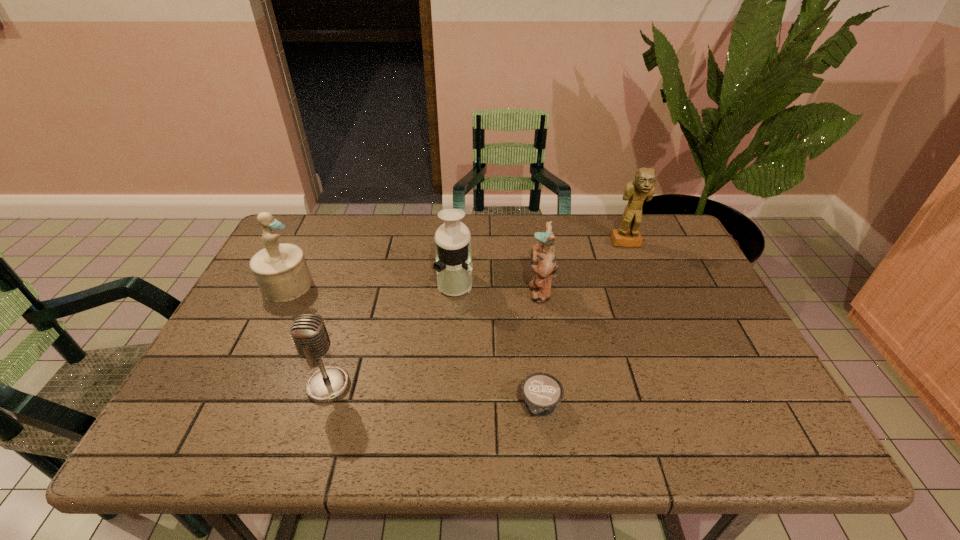
Where is `free space between the yogurt and the leftmost figurine`? free space between the yogurt and the leftmost figurine is located at coordinates (414, 346).

Where is `empty space between the yogurt and the farthest figurine`? empty space between the yogurt and the farthest figurine is located at coordinates (584, 325).

At what (x,y) coordinates should I click in order to perform the action: click on unoccupied area between the second figurine from right to left and the fifth object from right to left. Please return your answer as a coordinate pair (x, y). Looking at the image, I should click on (434, 338).

In order to click on free point between the leftmost object and the juicer in this screenshot , I will do `click(371, 284)`.

Where is `object identified as the fifth closest to the second figurine from right to left`? The image size is (960, 540). object identified as the fifth closest to the second figurine from right to left is located at coordinates (281, 271).

Identify which object is the fourth nearest to the second figurine from left to right. Please provide its 2D coordinates. Your answer should be formatted as a tuple, i.e. [(x, y)], where the tuple contains the x and y coordinates of a point satisfying the conditions above.

[(309, 333)]

Where is `the second closest figurine relative to the microphone`? This screenshot has height=540, width=960. the second closest figurine relative to the microphone is located at coordinates (543, 260).

Identify which figurine is located as the third nearest to the fifth object from right to left. Please provide its 2D coordinates. Your answer should be formatted as a tuple, i.e. [(x, y)], where the tuple contains the x and y coordinates of a point satisfying the conditions above.

[(642, 188)]

The width and height of the screenshot is (960, 540). Identify the location of vacant space that satisfies the following two spatial constraints: 1. on the front-facing side of the second figurine from right to left; 2. on the front side of the yogurt. (557, 407).

Locate an element on the screen. vacant space that satisfies the following two spatial constraints: 1. at the beak of the shortest object; 2. on the left side of the leftmost figurine is located at coordinates (228, 407).